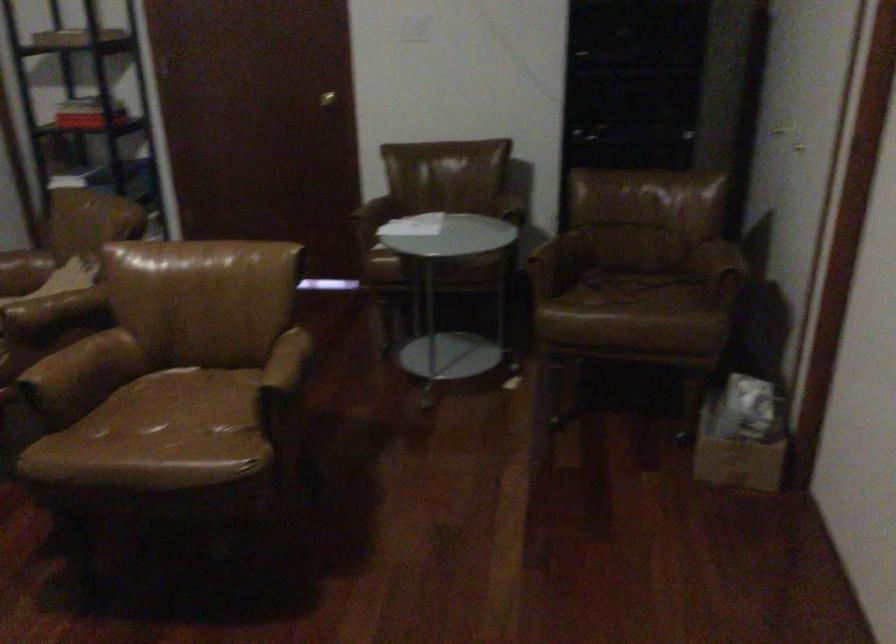
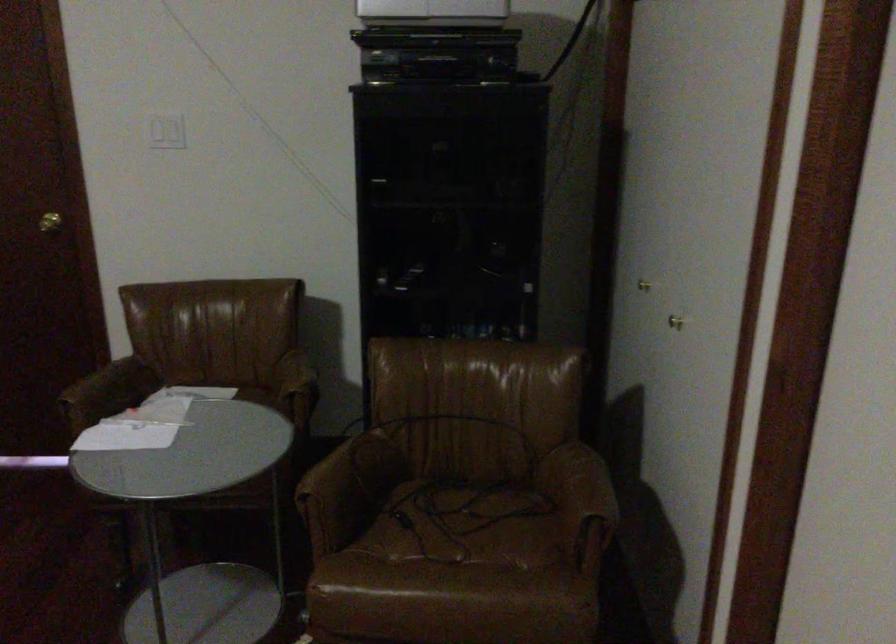
Find the pixel in the second image that matches (x=325, y=96) in the first image.

(49, 222)